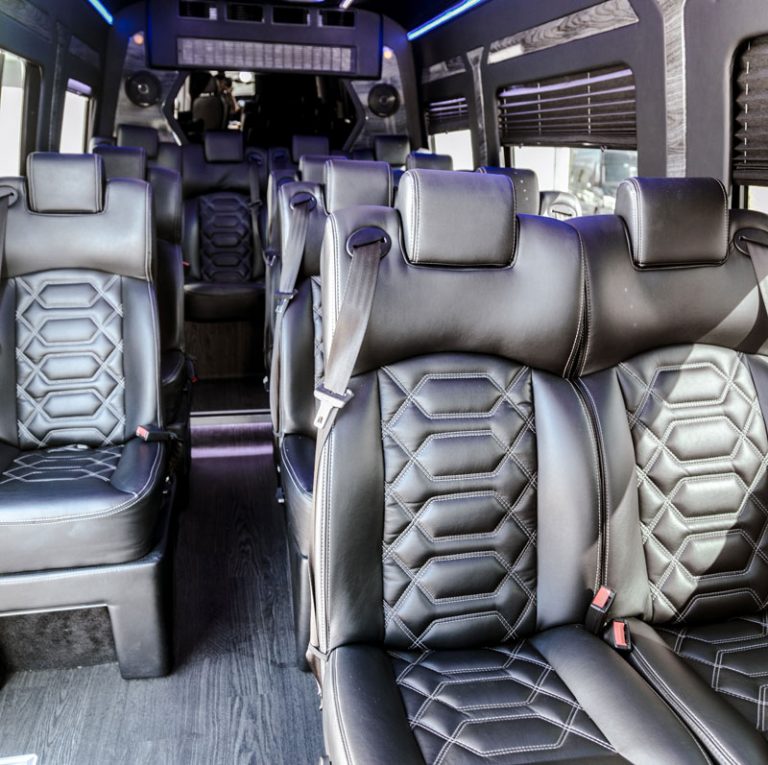
Image resolution: width=768 pixels, height=765 pixels. I want to click on floor, so click(210, 672).